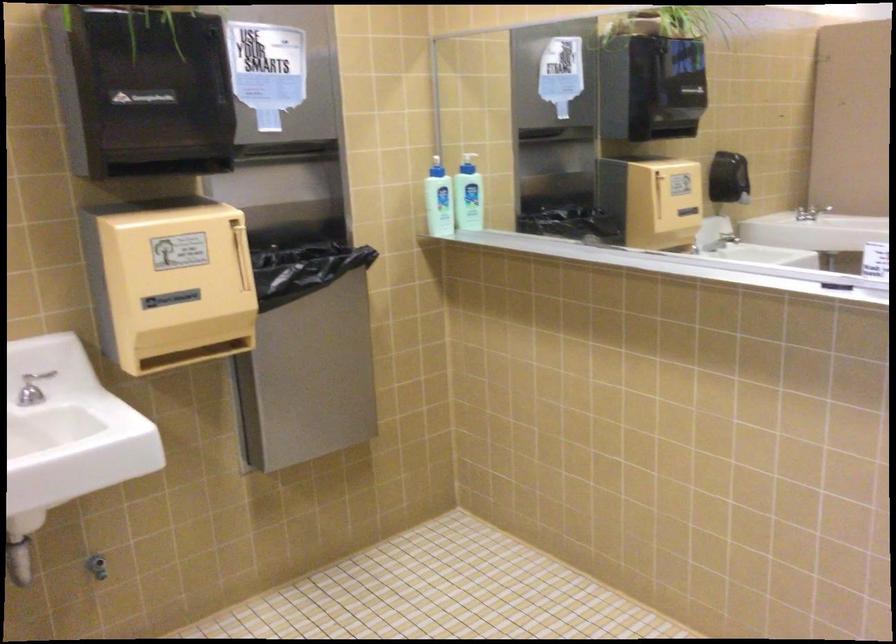
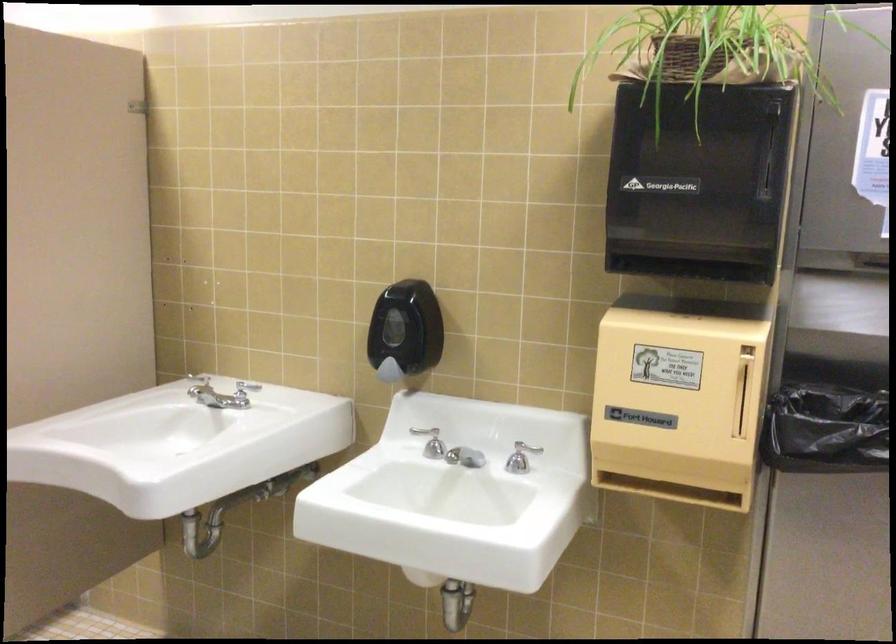
Find the pixel in the second image that matches (x=159, y=102) in the first image.

(698, 182)